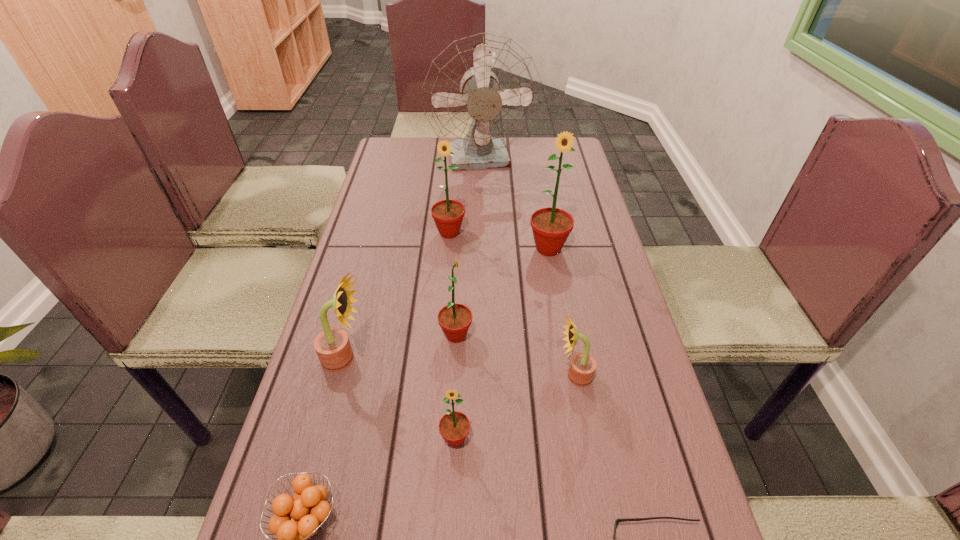
Identify the location of the second closest object to the second tallest sunflower. Image resolution: width=960 pixels, height=540 pixels. (482, 92).

You are a GUI agent. You are given a task and a screenshot of the screen. Output one action in this format:
    pyautogui.click(x=<x>, y=<y>)
    Task: Click on the object that is the second nearest to the third smallest green sunflower
    
    Given the screenshot: What is the action you would take?
    pyautogui.click(x=482, y=92)

The width and height of the screenshot is (960, 540). In order to click on the closest sunflower to the shortest object in this screenshot , I will do `click(582, 367)`.

This screenshot has width=960, height=540. I want to click on the fifth closest sunflower to the smaller yellow sunflower, so click(x=448, y=215).

Identify the location of green sunflower identified as the second closest to the shortest object. click(454, 319).

Identify the location of the closest green sunflower to the third farthest green sunflower. Image resolution: width=960 pixels, height=540 pixels. (454, 426).

Locate an element on the screen. Image resolution: width=960 pixels, height=540 pixels. vacant space that satisfies the following two spatial constraints: 1. in front of the fan to blow air; 2. on the face of the third farthest green sunflower is located at coordinates (484, 335).

The image size is (960, 540). What are the coordinates of `vacant position in the image that satisfies the following two spatial constraints: 1. in front of the farthest object to blow air; 2. on the face of the bigger yellow sunflower` in the screenshot? It's located at (484, 359).

Locate an element on the screen. Image resolution: width=960 pixels, height=540 pixels. free space that satisfies the following two spatial constraints: 1. in front of the tallest object to blow air; 2. on the face of the third biggest green sunflower is located at coordinates (484, 335).